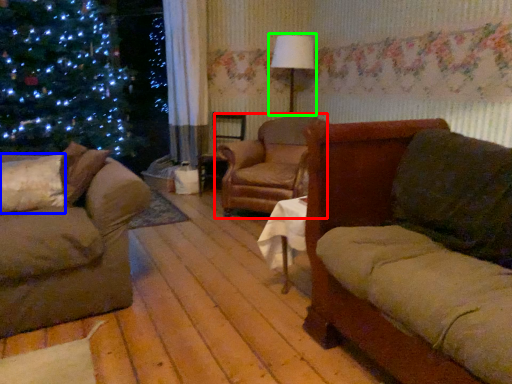
Question: Which is nearer to the chair (highlighted by a red box)? pillow (highlighted by a blue box) or lamp (highlighted by a green box).

Choices:
 (A) pillow
 (B) lamp

Answer: (B)